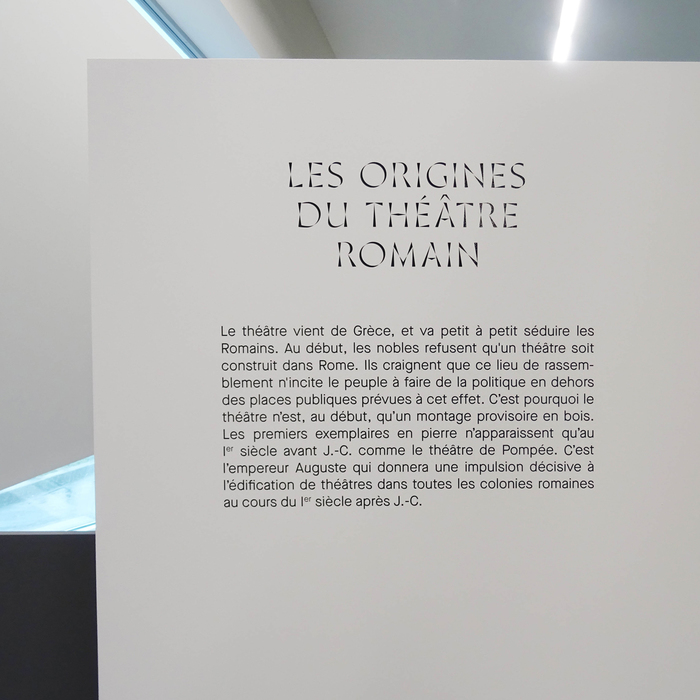
In order to click on window in this screenshot , I will do `click(190, 29)`.